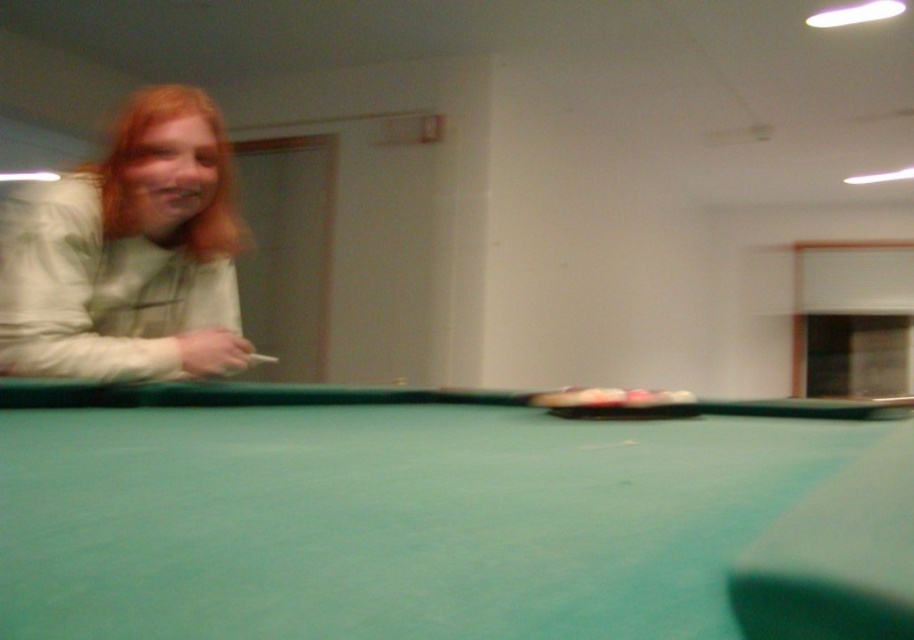
Question: Based on their relative distances, which object is farther from the blonde hair at left?

Choices:
 (A) green felt billiard table at center
 (B) blonde hair at upper left

Answer: (A)

Question: In this image, where is blonde hair at left located relative to blonde hair at upper left?

Choices:
 (A) above
 (B) below

Answer: (B)

Question: Which object is positioned closest to the blonde hair at left?

Choices:
 (A) green felt billiard table at center
 (B) blonde hair at upper left

Answer: (B)

Question: Can you confirm if green felt billiard table at center is positioned to the right of blonde hair at upper left?

Choices:
 (A) yes
 (B) no

Answer: (A)

Question: Does green felt billiard table at center have a smaller size compared to blonde hair at left?

Choices:
 (A) yes
 (B) no

Answer: (B)

Question: Among these objects, which one is farthest from the camera?

Choices:
 (A) green felt billiard table at center
 (B) blonde hair at left

Answer: (B)